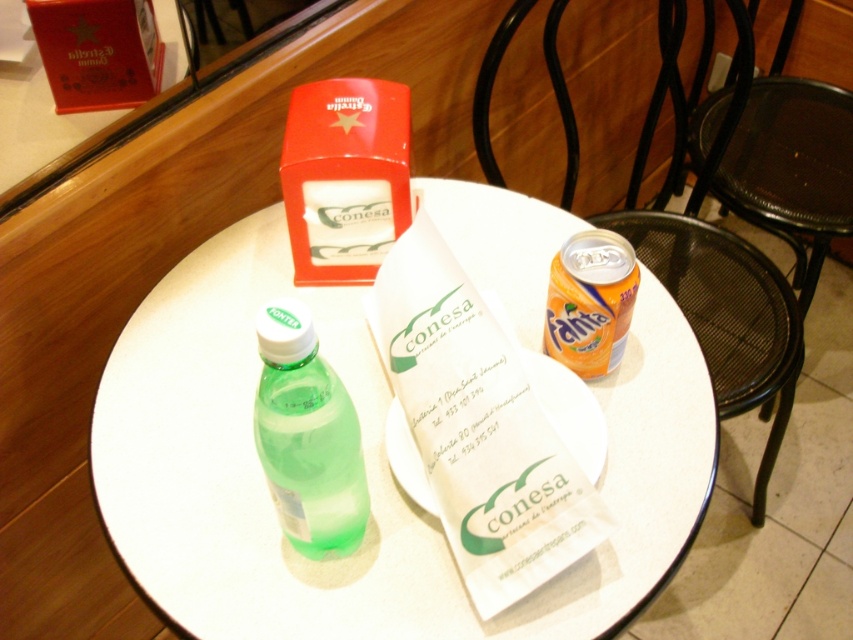
You are a customer at a cafe table with a transparent plastic bottle at center and a green translucent bottle at center. Which bottle can you pour more liquid into before it overflows?

The transparent plastic bottle at center has a larger size compared to the green translucent bottle at center, so it can hold more liquid before overflowing.

You are a customer at the table and want to slide a small spoon between the transparent plastic bottle at center and the orange matte can at upper right. Can the spoon fit horizontally between them?

The transparent plastic bottle at center is wider than the orange matte can at upper right, so the spoon may not fit horizontally between them due to the differing widths.

You are a customer at the table and want to read the menu. Which object is closer to you when you look down at the table? The white paper menu at center or the red plastic napkin dispenser at upper center?

The white paper menu at center is located below the red plastic napkin dispenser at upper center, so the red plastic napkin dispenser at upper center is closer to you when you look down at the table.